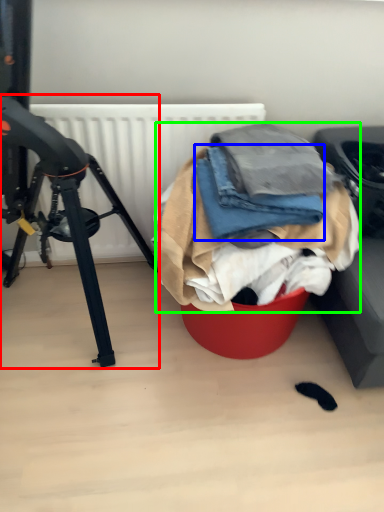
Question: Considering the real-world distances, which object is closest to tripod (highlighted by a red box)? clothing (highlighted by a blue box) or clothing (highlighted by a green box).

Choices:
 (A) clothing
 (B) clothing

Answer: (B)